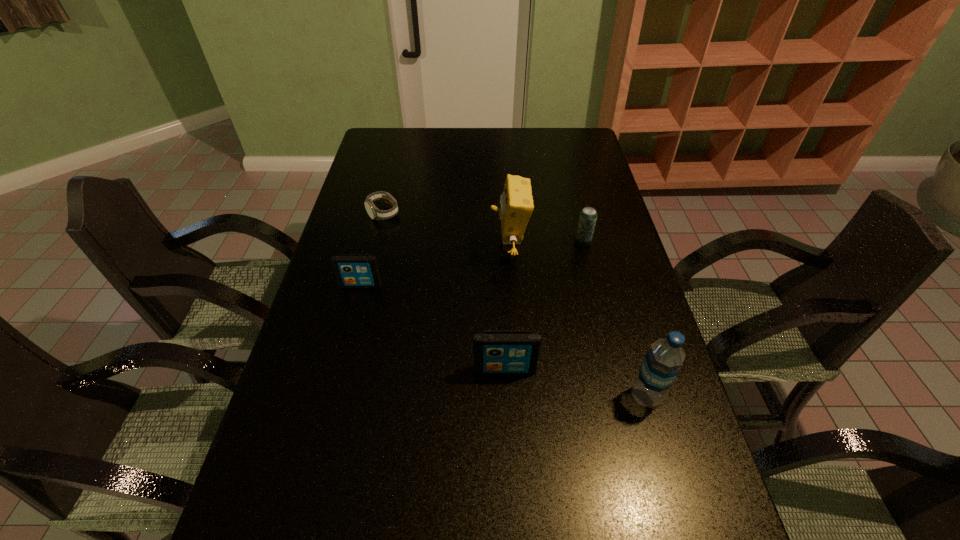
Please point out where to position a new iPod on the right to maintain spacing. Please provide its 2D coordinates. Your answer should be formatted as a tuple, i.e. [(x, y)], where the tuple contains the x and y coordinates of a point satisfying the conditions above.

[(713, 493)]